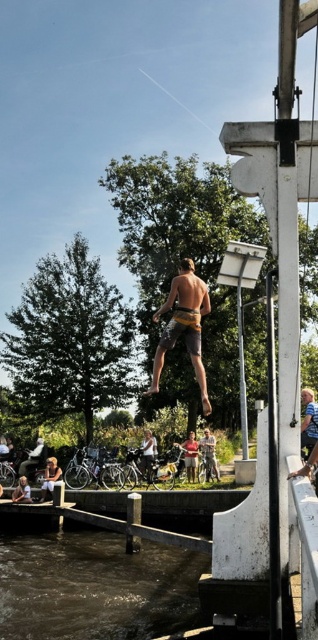
Question: Does light brown leather jacket at lower left come in front of brown leather shorts at center?

Choices:
 (A) yes
 (B) no

Answer: (B)

Question: Which of the following is the farthest from the observer?

Choices:
 (A) (304, 422)
 (B) (60, 468)

Answer: (B)

Question: Which of the following is the farthest from the observer?

Choices:
 (A) (182, 323)
 (B) (304, 420)

Answer: (B)

Question: Does blue denim shorts at center have a lesser width compared to brown leather shorts at center?

Choices:
 (A) no
 (B) yes

Answer: (A)

Question: Based on their relative distances, which object is nearer to the brown leather shorts at center?

Choices:
 (A) brown murky water at lower left
 (B) blue denim shorts at center
 (C) light brown leather jacket at lower left

Answer: (C)

Question: Is the position of brown textured shorts at center more distant than that of blue denim shorts at center?

Choices:
 (A) yes
 (B) no

Answer: (B)